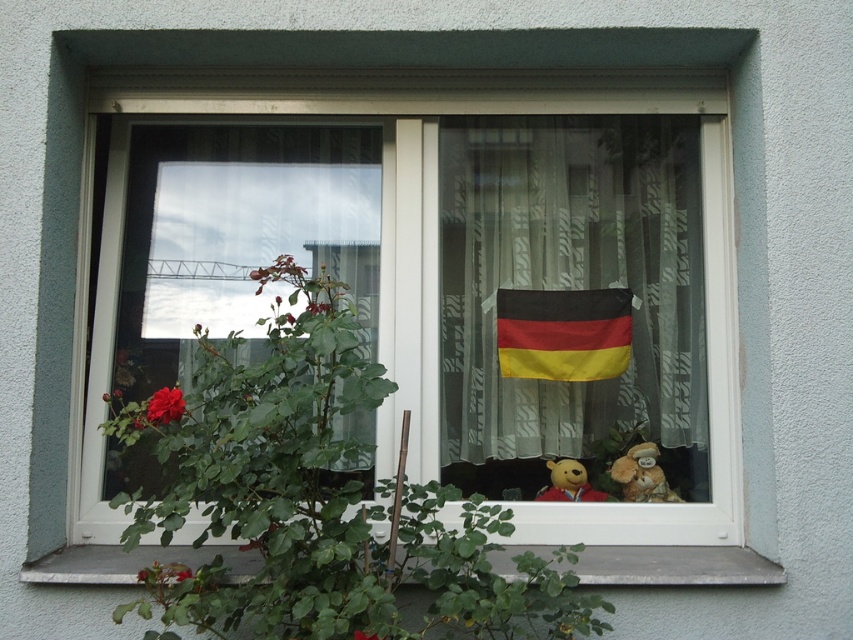
You are standing in a room and want to reach the black matte flag at center displayed on the right curtain of the window. Given that you can stretch your arm 1.8 meters, will you be able to touch the flag without moving from your current position?

The black matte flag at center is 2.05 meters away from the viewer. Since your arm can only stretch 1.8 meters, you cannot reach it without moving closer.

You are a delivery person trying to place a small package on the windowsill. The package must be placed between the silky sheer curtain at center and the velvety yellow bear at center. Is there enough space between them to fit the package?

The silky sheer curtain at center is to the left of the velvety yellow bear at center, so there is space between them to place the package.